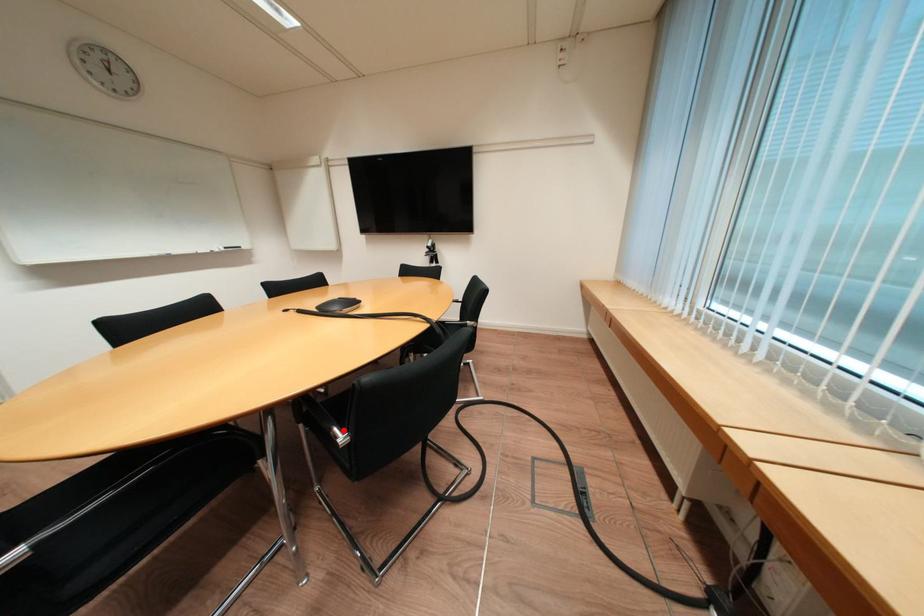
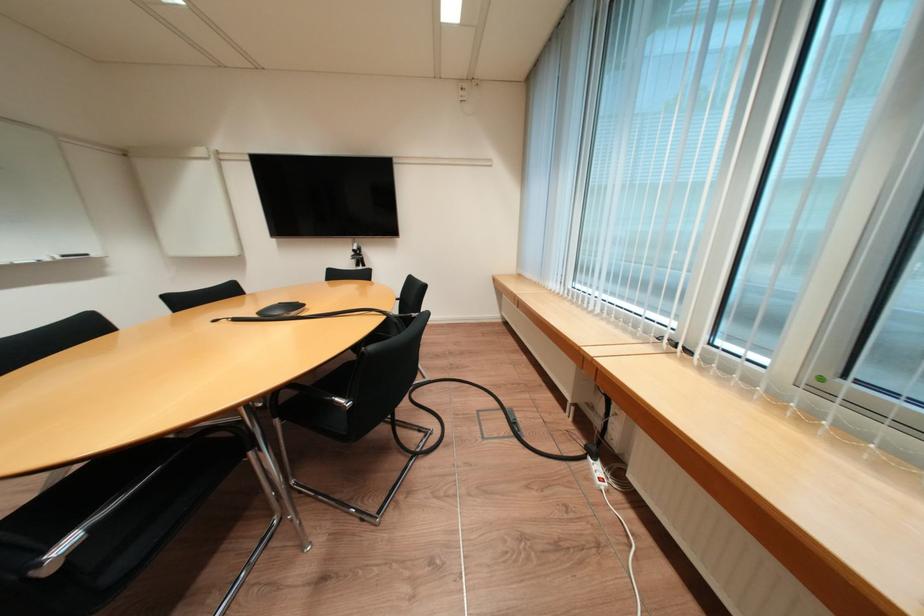
The point at the highlighted location is marked in the first image. Where is the corresponding point in the second image?

(345, 400)